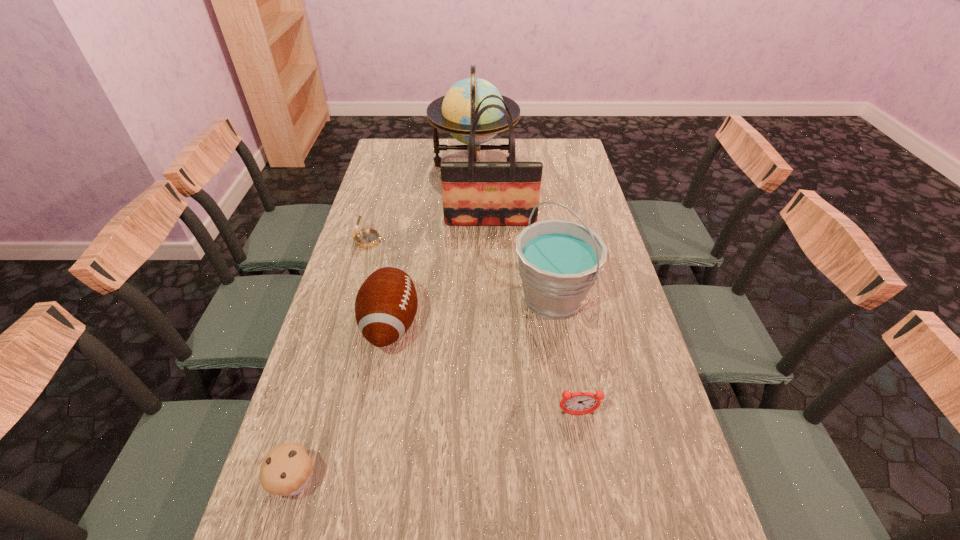
Where is `the second farthest object`? the second farthest object is located at coordinates (474, 193).

Where is `the farthest object`? This screenshot has height=540, width=960. the farthest object is located at coordinates (453, 113).

In order to click on the fifth shortest object in this screenshot , I will do `click(559, 261)`.

The image size is (960, 540). Find the location of `the fourth tallest object`. the fourth tallest object is located at coordinates (386, 304).

Image resolution: width=960 pixels, height=540 pixels. Find the location of `the fifth nearest object`. the fifth nearest object is located at coordinates (367, 238).

Image resolution: width=960 pixels, height=540 pixels. What are the coordinates of `alarm clock` in the screenshot? It's located at (579, 403).

Identify the location of muffin. (286, 469).

I want to click on vacant space located 0.120m on the front-facing side of the shopping bag, so click(492, 253).

Where is `free space located on the surface of the globe`? Image resolution: width=960 pixels, height=540 pixels. free space located on the surface of the globe is located at coordinates (563, 166).

This screenshot has width=960, height=540. I want to click on vacant space situated on the back of the third tallest object, so click(539, 211).